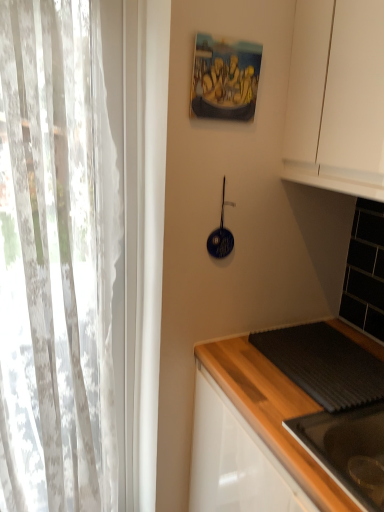
Where is `free space above dark gray textured mat at lower right (from a real-world perspective)`? This screenshot has height=512, width=384. free space above dark gray textured mat at lower right (from a real-world perspective) is located at coordinates (332, 350).